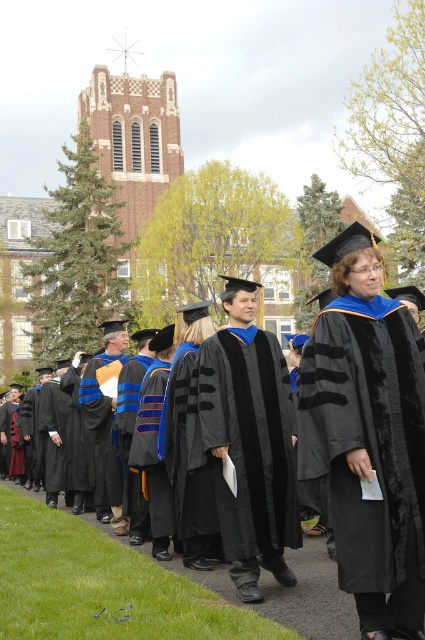
You are a photographer at the graduation ceremony. You see two graduates wearing matte black gown at center and matte black graduation gown at center. Which graduate is positioned more to the right?

The matte black gown at center is positioned more to the right than the matte black graduation gown at center.